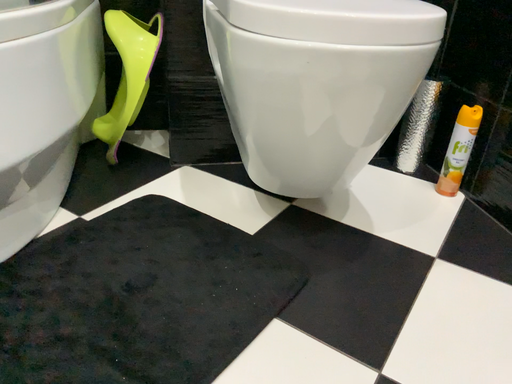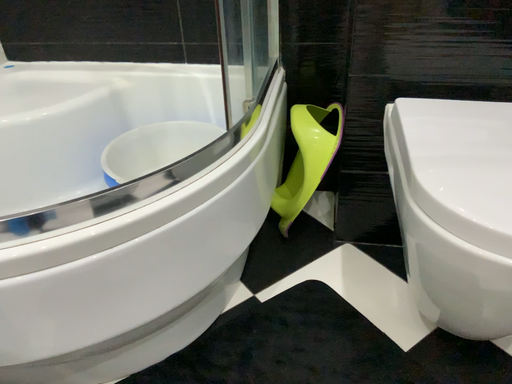
Question: Which way did the camera rotate in the video?

Choices:
 (A) rotated left
 (B) rotated right

Answer: (A)